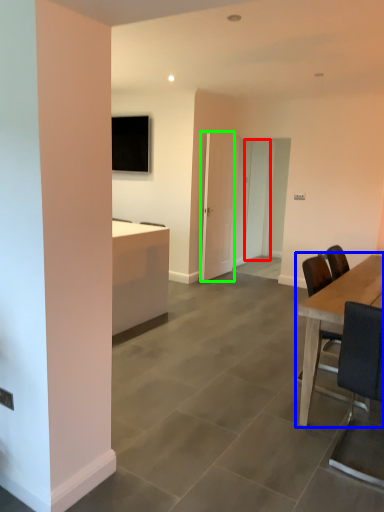
Question: Estimate the real-world distances between objects in this image. Which object is farther from glass door (highlighted by a red box), table (highlighted by a blue box) or glass door (highlighted by a green box)?

Choices:
 (A) table
 (B) glass door

Answer: (A)